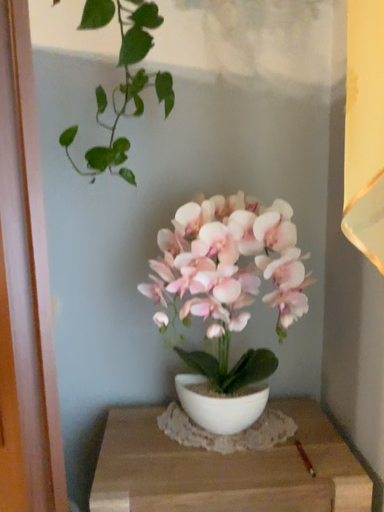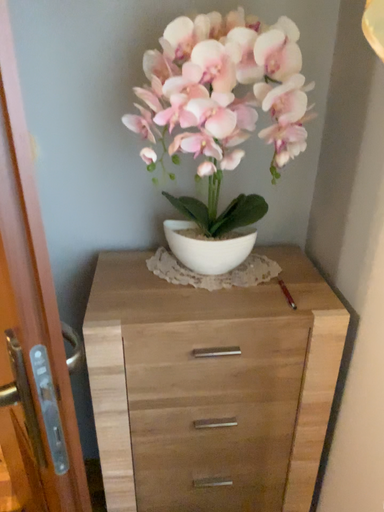
Question: How did the camera likely rotate when shooting the video?

Choices:
 (A) rotated upward
 (B) rotated downward

Answer: (B)